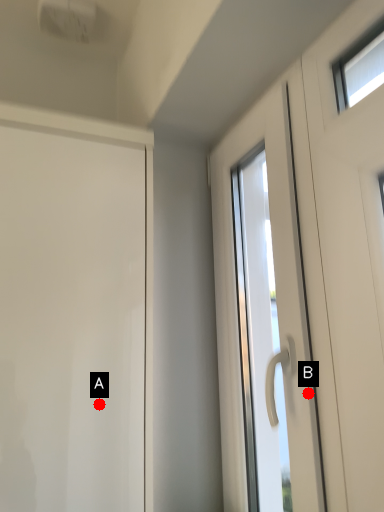
Question: Two points are circled on the image, labeled by A and B beside each circle. Which point is closer to the camera?

Choices:
 (A) A is closer
 (B) B is closer

Answer: (B)